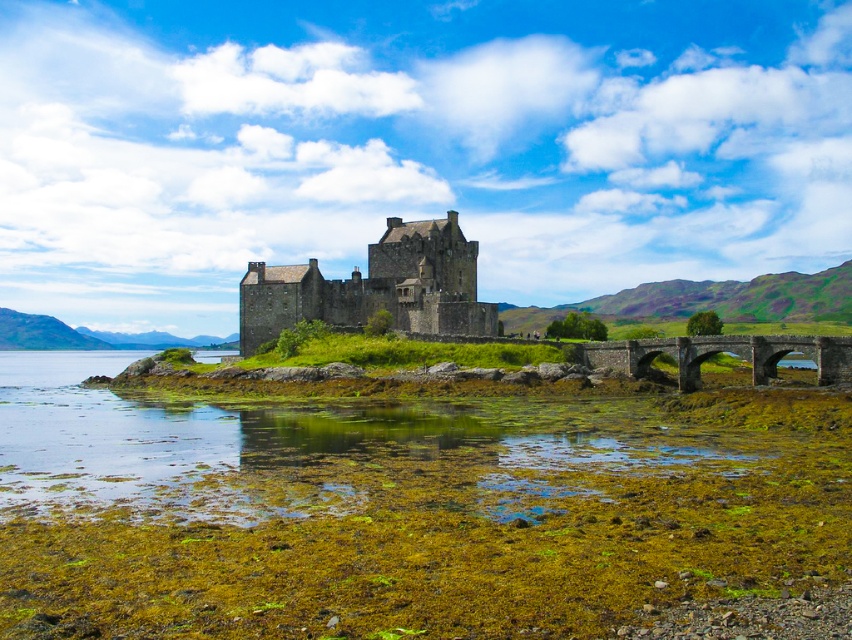
You are a tourist standing on the stone bridge and want to take a photo of the brown stone castle at center. However, you notice the green mossy water at lower center might block the view. Based on their sizes, which one should you move closer to in order to frame the castle properly?

The green mossy water at lower center is bigger than the brown stone castle at center. To frame the castle properly, you should move closer to the brown stone castle at center to reduce the dominance of the water in the frame.

You are a tourist standing on the stone arch bridge at center, wanting to take a photo of the brown stone castle at center. Since the bridge is part of the scene, how does the size of the castle compare to the bridge in your photo?

The brown stone castle at center is larger in size compared to the stone arch bridge at center, so in your photo, the castle will appear bigger than the bridge.

You are standing on the stone bridge and want to cross to the castle. Which direction should you move relative to the green mossy water at lower center to reach the brown stone castle at center?

To reach the brown stone castle at center from the green mossy water at lower center, you should move to the right since the castle is to the right of the water.